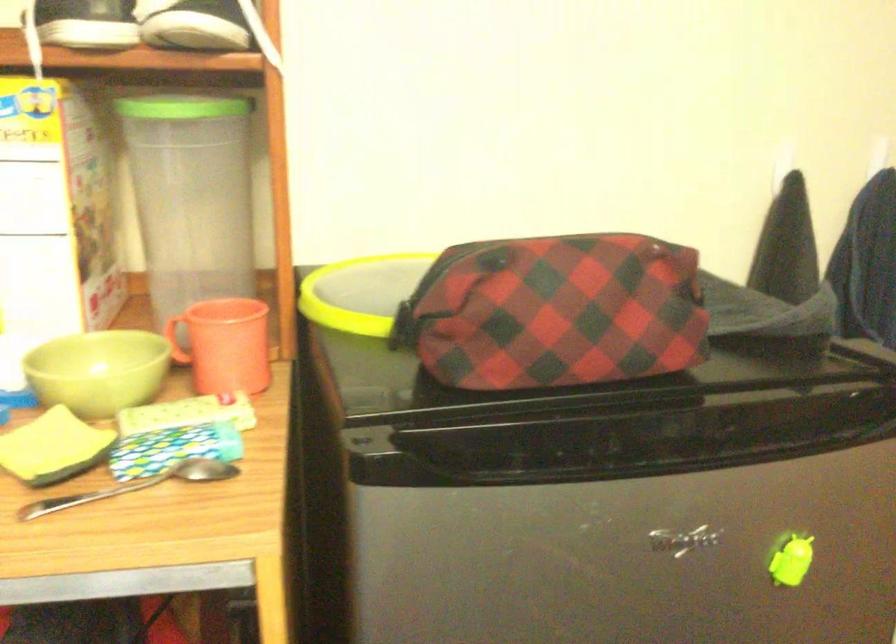
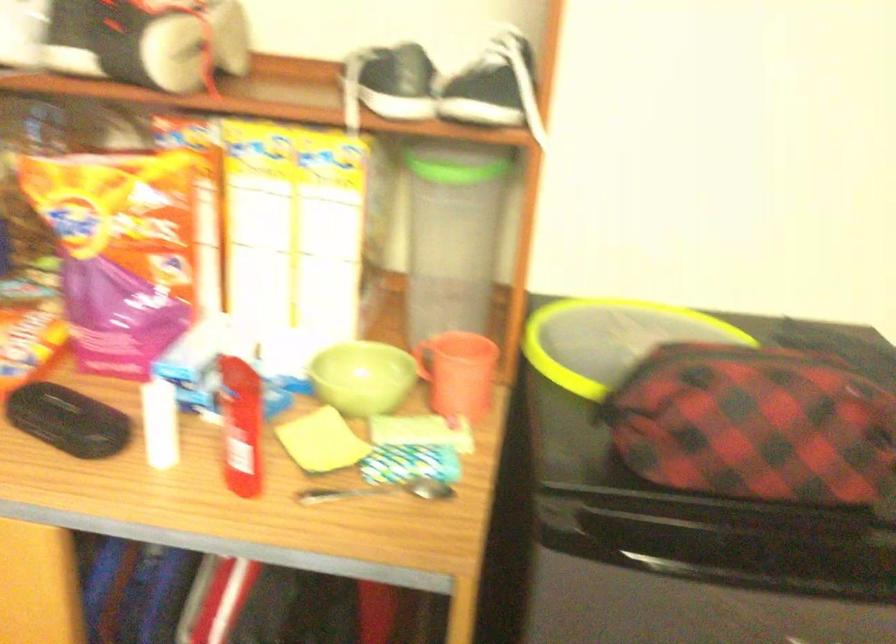
Question: The images are taken continuously from a first-person perspective. In which direction are you moving?

Choices:
 (A) Left
 (B) Right
 (C) Forward
 (D) Backward

Answer: (D)